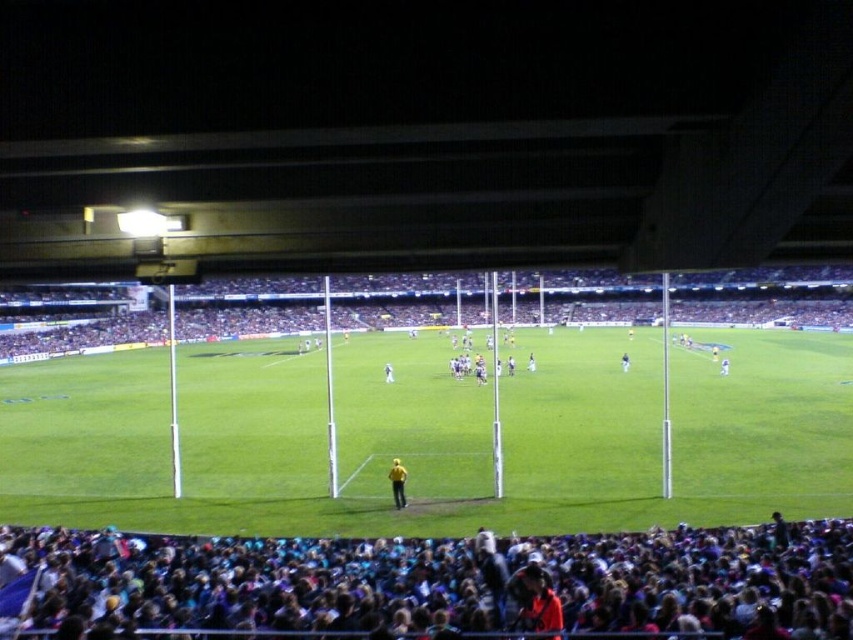
This screenshot has height=640, width=853. What are the coordinates of `green grass football field at center` in the screenshot? It's located at click(432, 435).

Which is below, green grass football field at center or dark blue fabric at lower center?

dark blue fabric at lower center

The height and width of the screenshot is (640, 853). Find the location of `green grass football field at center`. green grass football field at center is located at coordinates (432, 435).

The image size is (853, 640). In order to click on green grass football field at center in this screenshot , I will do `click(432, 435)`.

Is green grass football field at center further to the viewer compared to white fabric person at center?

That is False.

Which is behind, point (235, 413) or point (390, 378)?

Positioned behind is point (390, 378).

The image size is (853, 640). Identify the location of green grass football field at center. (432, 435).

Between dark blue fabric at lower center and white fabric person at center, which one has more height?

With more height is dark blue fabric at lower center.

Is dark blue fabric at lower center above white fabric person at center?

No, dark blue fabric at lower center is not above white fabric person at center.

What do you see at coordinates (428, 586) in the screenshot?
I see `dark blue fabric at lower center` at bounding box center [428, 586].

What are the coordinates of `dark blue fabric at lower center` in the screenshot? It's located at (428, 586).